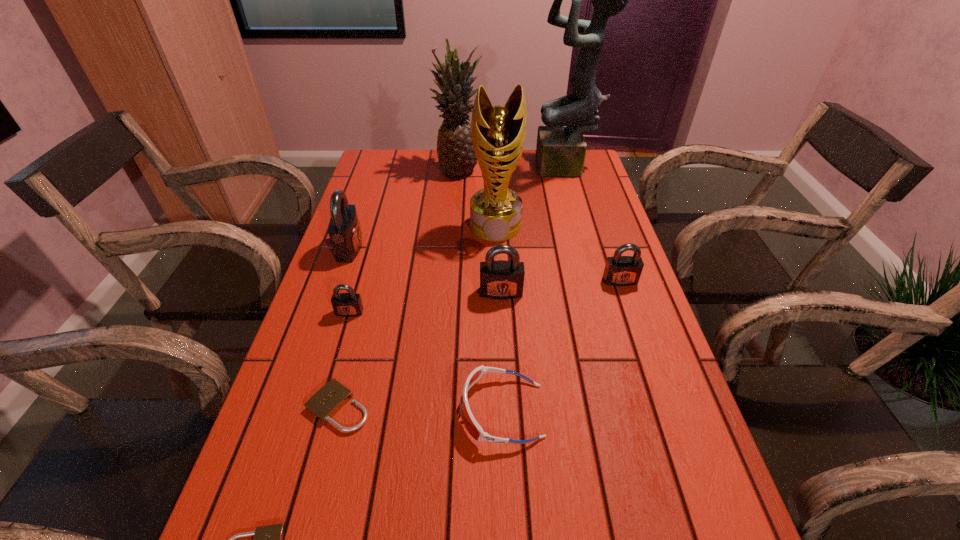
The image size is (960, 540). Identify the location of free spot that satisfies the following two spatial constraints: 1. on the face of the sculpture; 2. on the front side of the second shortest padlock. (633, 407).

This screenshot has height=540, width=960. I want to click on blank space that satisfies the following two spatial constraints: 1. on the front of the tallest padlock near the keyhole; 2. on the left side of the farther beige padlock, so click(x=296, y=407).